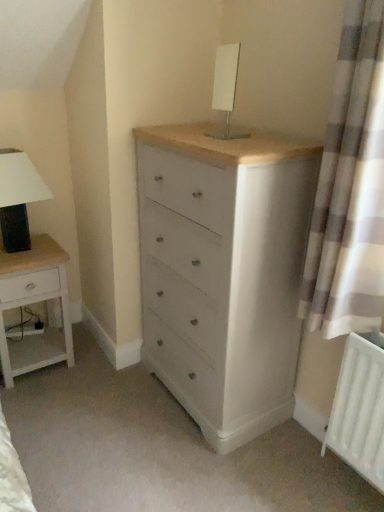
Question: Is matte black lampshade at left, which is the 1th table lamp from bottom to top, inside or outside of white checkered curtain at right?

Choices:
 (A) outside
 (B) inside

Answer: (A)

Question: In the image, is matte black lampshade at left, which appears as the first table lamp when viewed from the left, on the left side or the right side of white checkered curtain at right?

Choices:
 (A) left
 (B) right

Answer: (A)

Question: Which is nearer to the white checkered curtain at right?

Choices:
 (A) white matte radiator at lower right
 (B) matte black lampshade at left, which is the 2th table lamp from top to bottom
 (C) white wood nightstand at left
 (D) white glossy table lamp at upper center, arranged as the 2th table lamp when viewed from the back
 (E) matte white chest of drawers at center

Answer: (A)

Question: Which of these objects is positioned closest to the matte black lampshade at left, which appears as the first table lamp when viewed from the left?

Choices:
 (A) white wood nightstand at left
 (B) white checkered curtain at right
 (C) matte white chest of drawers at center
 (D) white matte radiator at lower right
 (E) white glossy table lamp at upper center, which appears as the 2th table lamp when viewed from the left

Answer: (A)